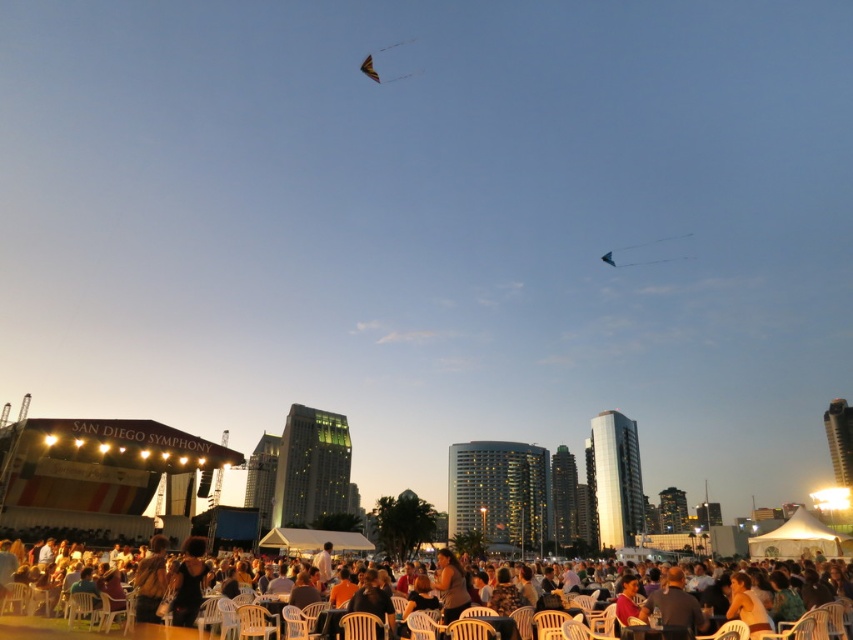
You are standing at the event and want to know how far you are from the stage. The stage is marked by the point at coordinates point (x=460, y=595). Can you determine the distance?

The point (x=460, y=595) is 35.95 meters from the viewer, so you are approximately 35.95 meters away from the stage.

You are standing at the point marked by the coordinates point (84, 630). Looking towards the stage labeled SAN DIEGO SYMPHONY, which is located at the opposite end of the white plastic chairs at lower center, will you have an unobstructed view?

The point (84, 630) marks the white plastic chairs at lower center. Since the stage labeled SAN DIEGO SYMPHONY is at the opposite end of the white plastic chairs at lower center, standing at this point would provide a clear view of the stage as there are no objects mentioned to obstruct the line of sight between the chairs and the stage.